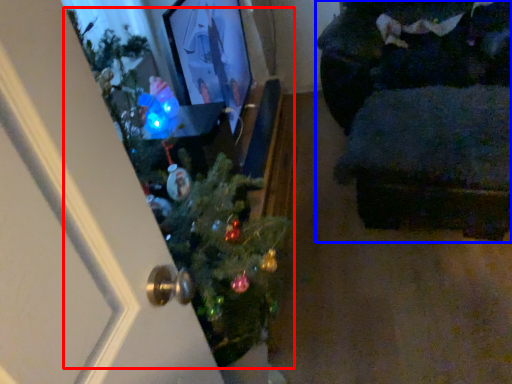
Question: Which object appears farthest to the camera in this image, christmas tree (highlighted by a red box) or furniture (highlighted by a blue box)?

Choices:
 (A) christmas tree
 (B) furniture

Answer: (B)